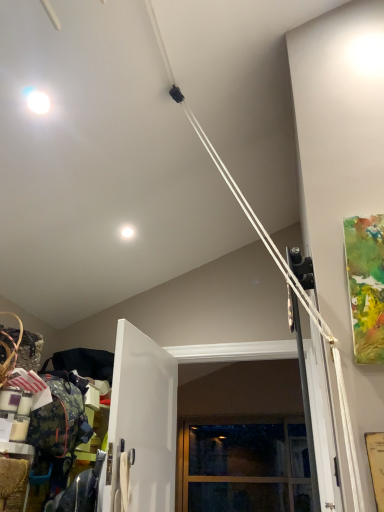
The image size is (384, 512). I want to click on white glossy door at center, so click(x=143, y=420).

Is white glossy door at center bigger than clear glass window at center?

Actually, white glossy door at center might be smaller than clear glass window at center.

From the image's perspective, which one is positioned higher, white glossy door at center or clear glass window at center?

white glossy door at center, from the image's perspective.

How much distance is there between white glossy door at center and clear glass window at center?

The distance of white glossy door at center from clear glass window at center is 3.04 meters.

Which is behind, point (135, 424) or point (282, 421)?

The point (282, 421) is farther from the camera.

Is clear glass window at center turned away from white glossy door at center?

No, clear glass window at center's orientation is not away from white glossy door at center.

From a real-world perspective, is clear glass window at center above or below white glossy door at center?

From a real-world perspective, clear glass window at center is physically below white glossy door at center.

Between clear glass window at center and white glossy door at center, which one has larger size?

With larger size is clear glass window at center.

Is clear glass window at center wider or thinner than white glossy door at center?

Clearly, clear glass window at center has more width compared to white glossy door at center.

Considering the sizes of objects clear glass window at center and white glossy droplight at upper center in the image provided, who is wider, clear glass window at center or white glossy droplight at upper center?

Wider between the two is clear glass window at center.

Considering the sizes of objects clear glass window at center and white glossy droplight at upper center in the image provided, who is smaller, clear glass window at center or white glossy droplight at upper center?

With smaller size is white glossy droplight at upper center.

From the image's perspective, is clear glass window at center on top of white glossy droplight at upper center?

Actually, clear glass window at center appears below white glossy droplight at upper center in the image.

How many degrees apart are the facing directions of clear glass window at center and white glossy droplight at upper center?

The angle between the facing direction of clear glass window at center and the facing direction of white glossy droplight at upper center is 89.5 degrees.

Between white glossy droplight at upper center and clear glass window at center, which one appears on the right side from the viewer's perspective?

Positioned to the right is clear glass window at center.

From a real-world perspective, is white glossy droplight at upper center on top of clear glass window at center?

Correct, in the physical world, white glossy droplight at upper center is higher than clear glass window at center.

Which object is further away from the camera, white glossy droplight at upper center or clear glass window at center?

clear glass window at center.

From the image's perspective, does white glossy droplight at upper center appear higher than clear glass window at center?

Indeed, from the image's perspective, white glossy droplight at upper center is shown above clear glass window at center.

Can you confirm if white glossy droplight at upper center is taller than white glossy door at center?

In fact, white glossy droplight at upper center may be shorter than white glossy door at center.

Considering the relative sizes of white glossy droplight at upper center and white glossy door at center in the image provided, is white glossy droplight at upper center thinner than white glossy door at center?

Incorrect, the width of white glossy droplight at upper center is not less than that of white glossy door at center.

Measure the distance between white glossy droplight at upper center and white glossy door at center.

92.99 centimeters.

Which is further, [128,233] or [123,328]?

The point [128,233] is behind.

Is white glossy door at center positioned before white glossy droplight at upper center?

That is True.

From the picture: Is white glossy door at center completely or partially outside of white glossy droplight at upper center?

Indeed, white glossy door at center is completely outside white glossy droplight at upper center.

Is white glossy door at center positioned with its back to white glossy droplight at upper center?

No, white glossy door at center is not facing the opposite direction of white glossy droplight at upper center.

At what (x,y) coordinates should I click in order to perform the action: click on door below the white glossy droplight at upper center (from the image's perspective). Please return your answer as a coordinate pair (x, y). The width and height of the screenshot is (384, 512). Looking at the image, I should click on click(143, 420).

Locate an element on the screen. The height and width of the screenshot is (512, 384). window below the white glossy door at center (from a real-world perspective) is located at coordinates (243, 466).

Identify the location of window on the right of white glossy door at center. (243, 466).

Looking at the image, which one is located closer to clear glass window at center, white glossy door at center or white glossy droplight at upper center?

white glossy door at center.

When comparing their distances from white glossy droplight at upper center, does white glossy door at center or clear glass window at center seem closer?

Among the two, white glossy door at center is located nearer to white glossy droplight at upper center.

Which object lies further to the anchor point white glossy door at center, white glossy droplight at upper center or clear glass window at center?

The object further to white glossy door at center is clear glass window at center.

Which object lies nearer to the anchor point white glossy door at center, clear glass window at center or white glossy droplight at upper center?

The object closer to white glossy door at center is white glossy droplight at upper center.

Which object lies further to the anchor point clear glass window at center, white glossy droplight at upper center or white glossy door at center?

→ white glossy droplight at upper center.

When comparing their distances from white glossy droplight at upper center, does clear glass window at center or white glossy door at center seem further?

The object further to white glossy droplight at upper center is clear glass window at center.

Locate an element on the screen. This screenshot has height=512, width=384. droplight positioned between white glossy door at center and clear glass window at center from near to far is located at coordinates (127, 232).